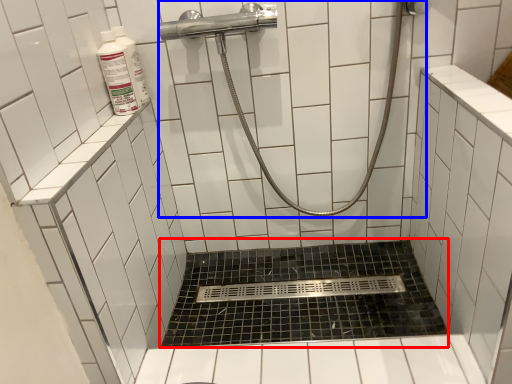
Question: Which object is further to the camera taking this photo, bath (highlighted by a red box) or shower (highlighted by a blue box)?

Choices:
 (A) bath
 (B) shower

Answer: (A)